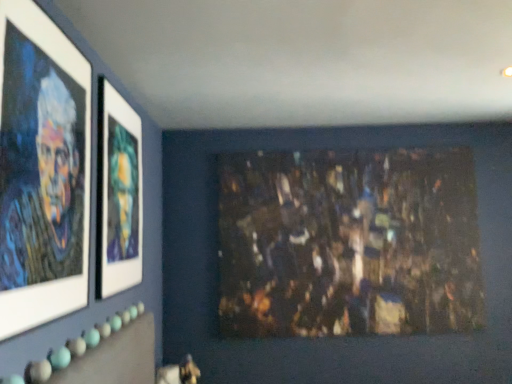
Question: Does matte glass picture frame at upper left, the second picture frame viewed from the front, appear on the right side of dark textured painting at center?

Choices:
 (A) yes
 (B) no

Answer: (B)

Question: Does matte glass picture frame at upper left, the first picture frame viewed from the back, have a lesser height compared to dark textured painting at center?

Choices:
 (A) no
 (B) yes

Answer: (B)

Question: Is matte glass picture frame at upper left, the second picture frame viewed from the front, taller than dark textured painting at center?

Choices:
 (A) yes
 (B) no

Answer: (B)

Question: From a real-world perspective, is matte glass picture frame at upper left, the second picture frame viewed from the front, below dark textured painting at center?

Choices:
 (A) yes
 (B) no

Answer: (B)

Question: Is matte glass picture frame at upper left, the second picture frame viewed from the front, surrounding dark textured painting at center?

Choices:
 (A) yes
 (B) no

Answer: (B)

Question: From a real-world perspective, is matte glass picture frame at upper left, the second picture frame viewed from the front, physically above dark textured painting at center?

Choices:
 (A) no
 (B) yes

Answer: (B)

Question: From a real-world perspective, does matte black portrait at left, arranged as the 1th picture frame when viewed from the front, stand above matte glass picture frame at upper left, the first picture frame viewed from the back?

Choices:
 (A) no
 (B) yes

Answer: (A)

Question: Is matte black portrait at left, arranged as the 1th picture frame when viewed from the front, oriented away from matte glass picture frame at upper left, the first picture frame viewed from the back?

Choices:
 (A) no
 (B) yes

Answer: (A)

Question: Is the depth of matte black portrait at left, which is counted as the 2th picture frame, starting from the back, greater than that of matte glass picture frame at upper left, the first picture frame viewed from the back?

Choices:
 (A) no
 (B) yes

Answer: (A)

Question: Are matte black portrait at left, arranged as the 1th picture frame when viewed from the front, and matte glass picture frame at upper left, the second picture frame viewed from the front, far apart?

Choices:
 (A) yes
 (B) no

Answer: (B)

Question: Does matte black portrait at left, arranged as the 1th picture frame when viewed from the front, have a larger size compared to matte glass picture frame at upper left, the second picture frame viewed from the front?

Choices:
 (A) yes
 (B) no

Answer: (B)

Question: Considering the relative sizes of matte black portrait at left, which is counted as the 2th picture frame, starting from the back, and matte glass picture frame at upper left, the first picture frame viewed from the back, in the image provided, is matte black portrait at left, which is counted as the 2th picture frame, starting from the back, wider than matte glass picture frame at upper left, the first picture frame viewed from the back,?

Choices:
 (A) yes
 (B) no

Answer: (B)

Question: Is dark textured painting at center turned away from matte glass picture frame at upper left, the first picture frame viewed from the back?

Choices:
 (A) yes
 (B) no

Answer: (B)